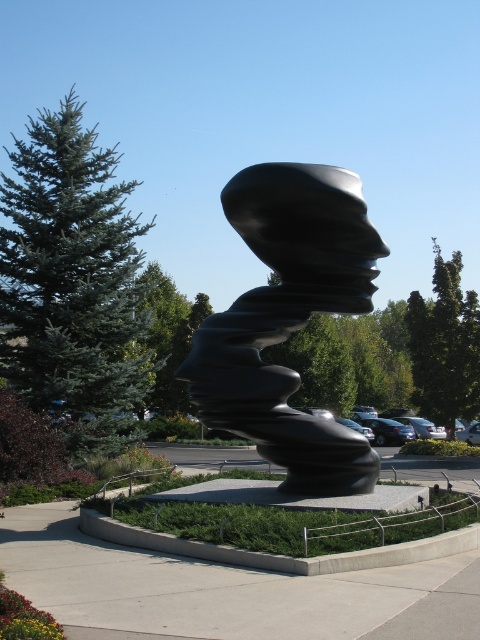
Question: Does black polished sculpture at center come behind black polished head at center?

Choices:
 (A) no
 (B) yes

Answer: (B)

Question: Is black polished sculpture at center positioned at the back of black polished head at center?

Choices:
 (A) no
 (B) yes

Answer: (B)

Question: Which point appears farthest from the camera in this image?

Choices:
 (A) (288, 214)
 (B) (247, 371)

Answer: (B)

Question: Can you confirm if black polished sculpture at center is positioned above black polished head at center?

Choices:
 (A) no
 (B) yes

Answer: (A)